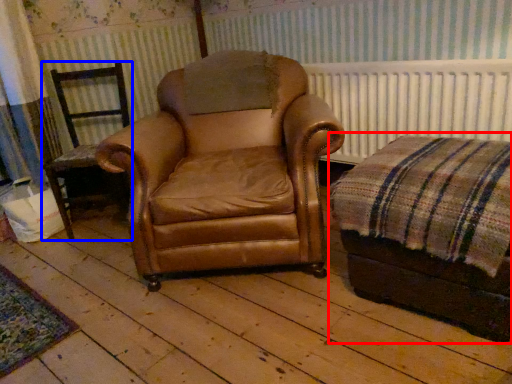
Question: Which point is closer to the camera, couch (highlighted by a red box) or chair (highlighted by a blue box)?

Choices:
 (A) couch
 (B) chair

Answer: (A)